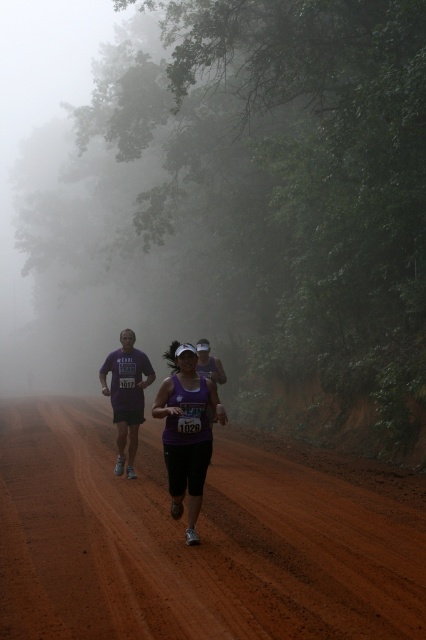
You are a drone operator tasked with capturing aerial footage of the brown dirt track at center. The drone has a GPS coordinate system where the bottom left corner is the origin point. The track is located at point 0.855, 0.446. If you want to hover the drone directly above the track, what coordinates should you set?

The coordinates to hover directly above the brown dirt track at center would be (x=189, y=547).

From the picture: You are a photographer at the race event and want to capture a clear photo of both the purple fabric tank top at center and the purple fabric runner at center. Since the camera can only focus on one object at a time, which object should you choose to ensure the details of the larger one are captured clearly?

The purple fabric tank top at center has a larger size compared to the purple fabric runner at center, so you should focus on the purple fabric tank top at center to capture its details clearly.